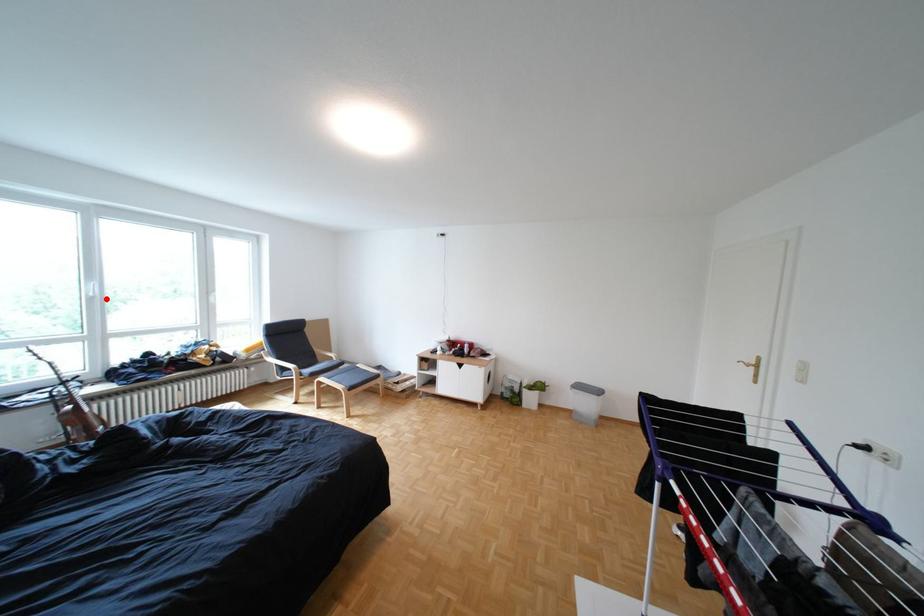
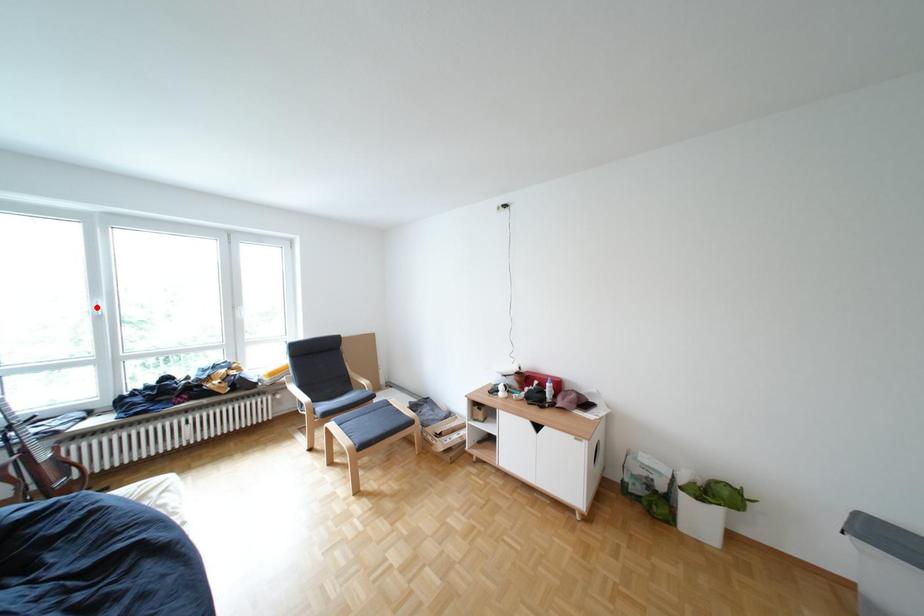
I am providing you with two images of the same scene from different viewpoints. A red point is marked on the first image and another point is marked on the second image. Does the point marked in image1 correspond to the same location as the one in image2?

No